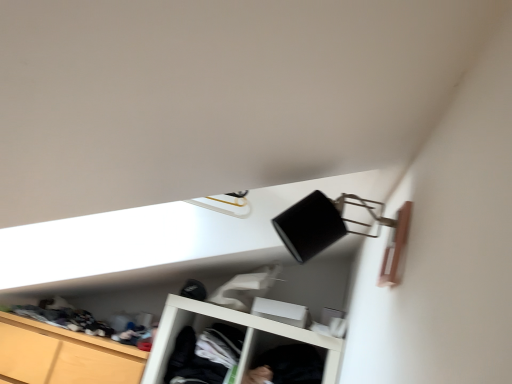
Question: From the image's perspective, is black cotton shirt at lower center, the second clothing viewed from the left, above or below wooden cabinet at lower left?

Choices:
 (A) above
 (B) below

Answer: (A)

Question: Is black cotton shirt at lower center, the second clothing viewed from the left, spatially inside wooden cabinet at lower left, or outside of it?

Choices:
 (A) outside
 (B) inside

Answer: (A)

Question: Which of these objects is positioned farthest from the black cotton shirt at lower center, the second clothing viewed from the left?

Choices:
 (A) wooden cabinet at lower left
 (B) dark gray fabric at center, the first clothing when ordered from left to right

Answer: (A)

Question: Which is nearer to the wooden cabinet at lower left?

Choices:
 (A) black cotton shirt at lower center, the second clothing viewed from the left
 (B) dark gray fabric at center, the second clothing when ordered from right to left

Answer: (B)